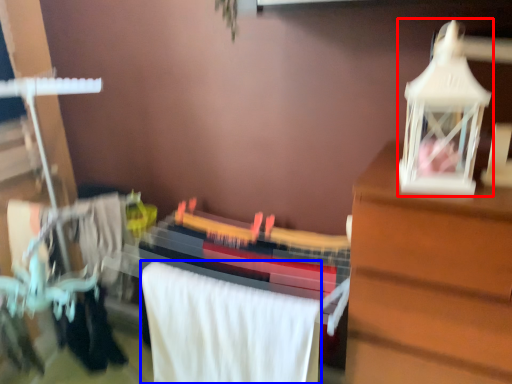
Question: Which object is further to the camera taking this photo, toy (highlighted by a red box) or bath towel (highlighted by a blue box)?

Choices:
 (A) toy
 (B) bath towel

Answer: (B)